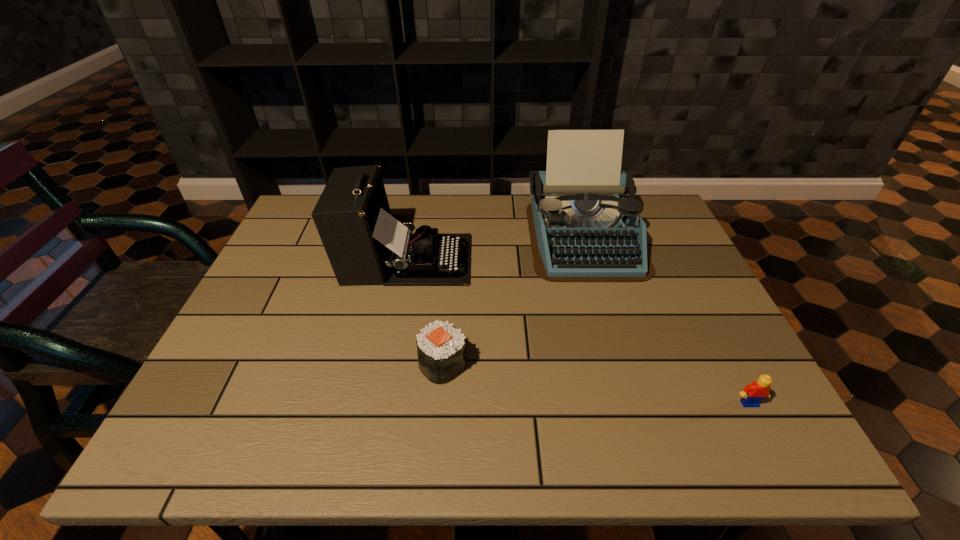
I want to click on the left typewriter, so click(x=365, y=244).

At what (x,y) coordinates should I click in order to perform the action: click on the right typewriter. Please return your answer as a coordinate pair (x, y). This screenshot has width=960, height=540. Looking at the image, I should click on [584, 224].

The width and height of the screenshot is (960, 540). Identify the location of sushi. (441, 350).

I want to click on the nearest object, so click(x=752, y=394).

Identify the location of the rightmost object. The width and height of the screenshot is (960, 540). (752, 394).

This screenshot has width=960, height=540. I want to click on free space located 0.340m inside the open case of the left typewriter, so pos(595,259).

This screenshot has height=540, width=960. I want to click on vacant space located on the typing side of the third object from left to right, so click(617, 356).

Image resolution: width=960 pixels, height=540 pixels. In order to click on vacant space located 0.390m on the back of the sushi in this screenshot , I will do `click(452, 240)`.

Identify the location of vacant space situated on the face of the nearest object. (766, 436).

I want to click on typewriter that is at the right edge, so click(x=584, y=224).